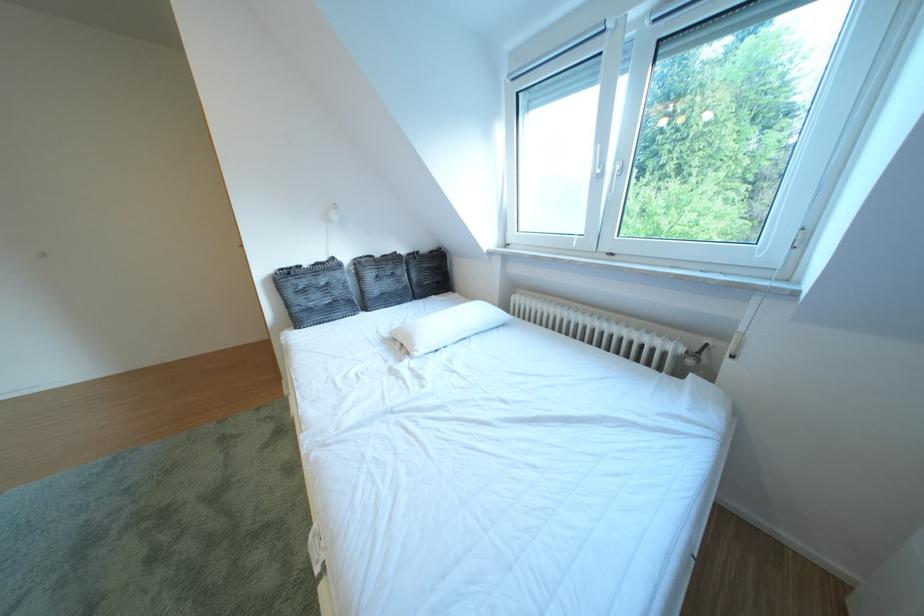
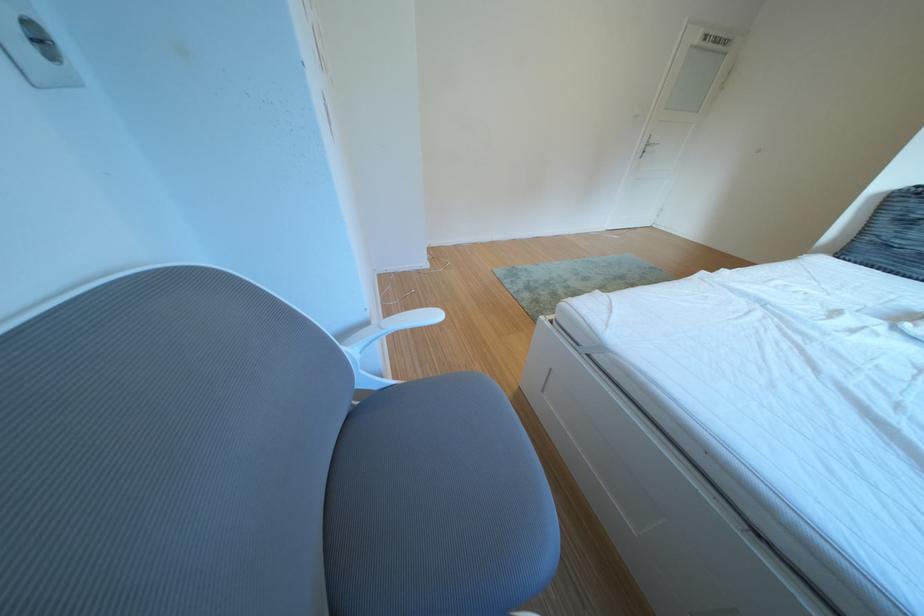
How did the camera likely rotate?

The rotation direction of the camera is left-down.